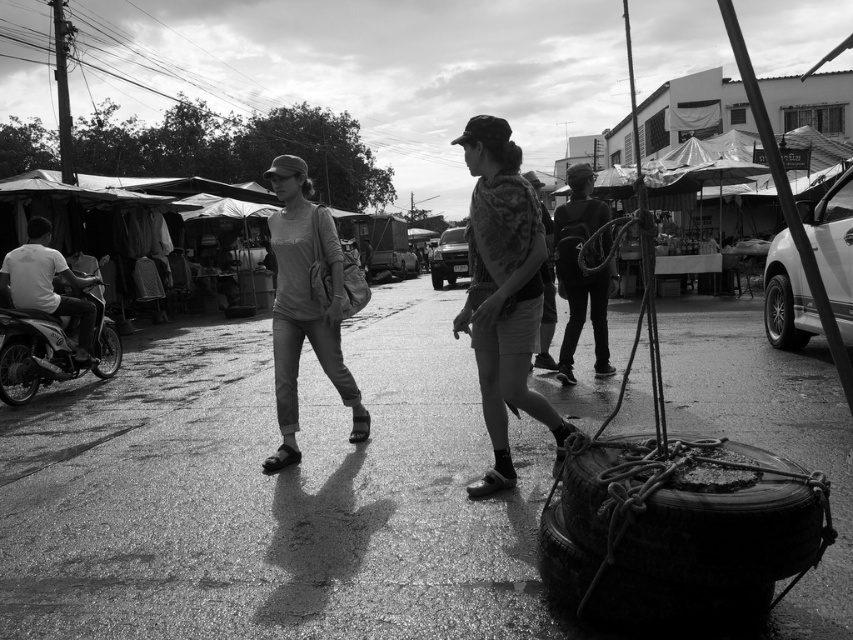
In the black and white photo of the market street, there are two people walking side by side. A smooth metallic pole is marked at point [62,92]. From the perspective of the person in the light colored top, which direction is the smooth metallic pole at upper left located?

The smooth metallic pole at upper left is located to the left side of the person in the light colored top.

You are a delivery person who needs to park your bike on the smooth asphalt pavement at center. However, there is a rubber tire at left blocking the entrance. Can you still park your bike there?

The smooth asphalt pavement at center is much taller than the rubber tire at left, so the bike can be parked there as the pavement is elevated enough to allow access despite the tire being present.